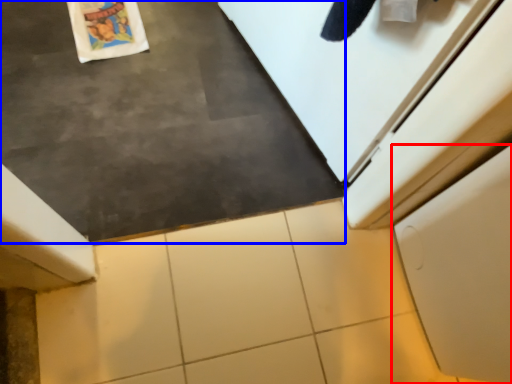
Question: Which object appears farthest to the camera in this image, cabinetry (highlighted by a red box) or slate (highlighted by a blue box)?

Choices:
 (A) cabinetry
 (B) slate

Answer: (A)